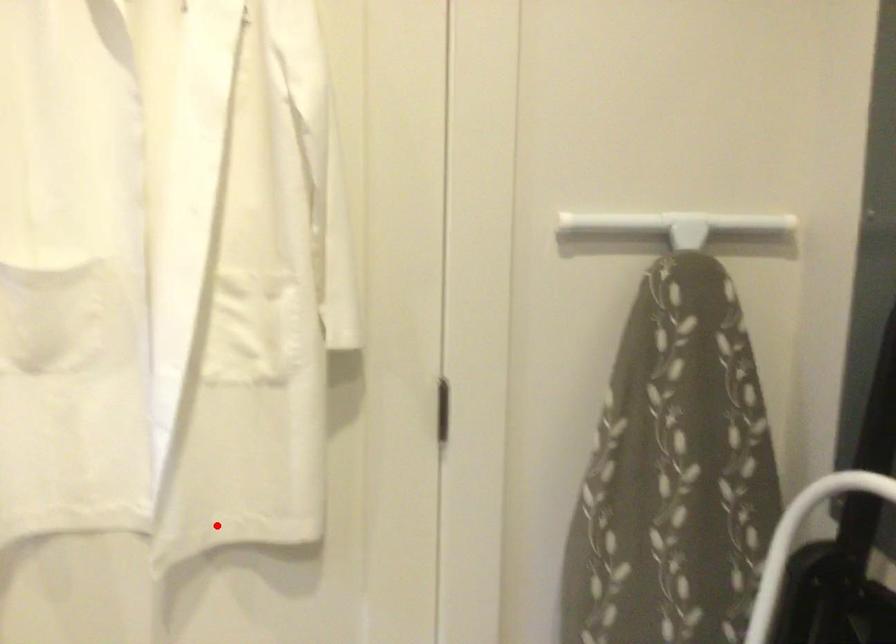
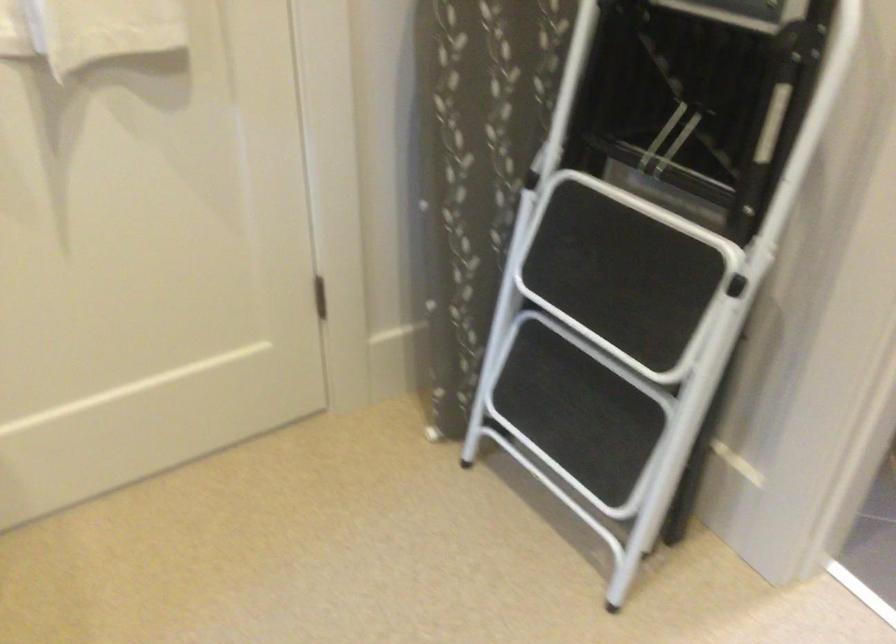
Locate, in the second image, the point that corresponds to the highlighted location in the first image.

(89, 30)